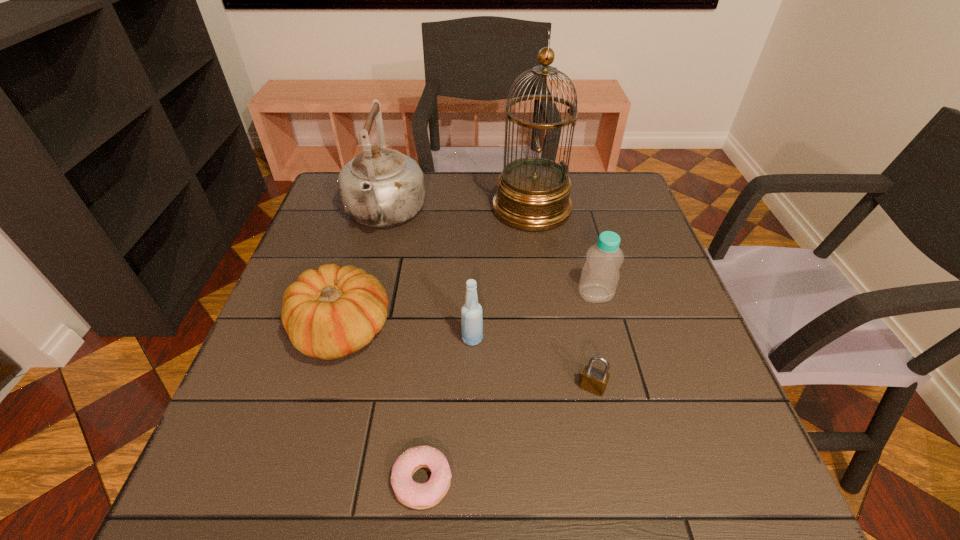
What are the coordinates of `blank region between the kettle and the birdcage` in the screenshot? It's located at (458, 212).

Where is `vacant point located between the padlock and the second tallest object`? vacant point located between the padlock and the second tallest object is located at coordinates (489, 301).

Identify which object is the second closest to the right bottle. Please provide its 2D coordinates. Your answer should be formatted as a tuple, i.e. [(x, y)], where the tuple contains the x and y coordinates of a point satisfying the conditions above.

[(533, 193)]

Identify the location of object identified as the second closest to the tallest object. This screenshot has width=960, height=540. (600, 275).

This screenshot has width=960, height=540. I want to click on free region that satisfies the following two spatial constraints: 1. on the back side of the right bottle; 2. on the left side of the nearest object, so click(440, 294).

Find the location of `vacant space that satisfies the following two spatial constraints: 1. on the back side of the left bottle; 2. on the right side of the doughnut`. vacant space that satisfies the following two spatial constraints: 1. on the back side of the left bottle; 2. on the right side of the doughnut is located at coordinates (436, 339).

At what (x,y) coordinates should I click in order to perform the action: click on vacant region that satisfies the following two spatial constraints: 1. at the spout of the sixth farthest object; 2. on the left side of the kettle. Please return your answer as a coordinate pair (x, y). Looking at the image, I should click on (339, 387).

Find the location of a particular element. The height and width of the screenshot is (540, 960). vacant space that satisfies the following two spatial constraints: 1. at the spout of the right bottle; 2. on the right side of the kettle is located at coordinates (364, 294).

You are a GUI agent. You are given a task and a screenshot of the screen. Output one action in this format:
    pyautogui.click(x=<x>, y=<y>)
    Task: Click on the free location that satisfies the following two spatial constraints: 1. with an open door on the tallest object; 2. at the spout of the kettle
    Image resolution: width=960 pixels, height=540 pixels.
    Given the screenshot: What is the action you would take?
    [533, 214]

Image resolution: width=960 pixels, height=540 pixels. Find the location of `vacant region that satisfies the following two spatial constraints: 1. on the back side of the farther bottle; 2. on the left side of the shortest object`. vacant region that satisfies the following two spatial constraints: 1. on the back side of the farther bottle; 2. on the left side of the shortest object is located at coordinates (440, 294).